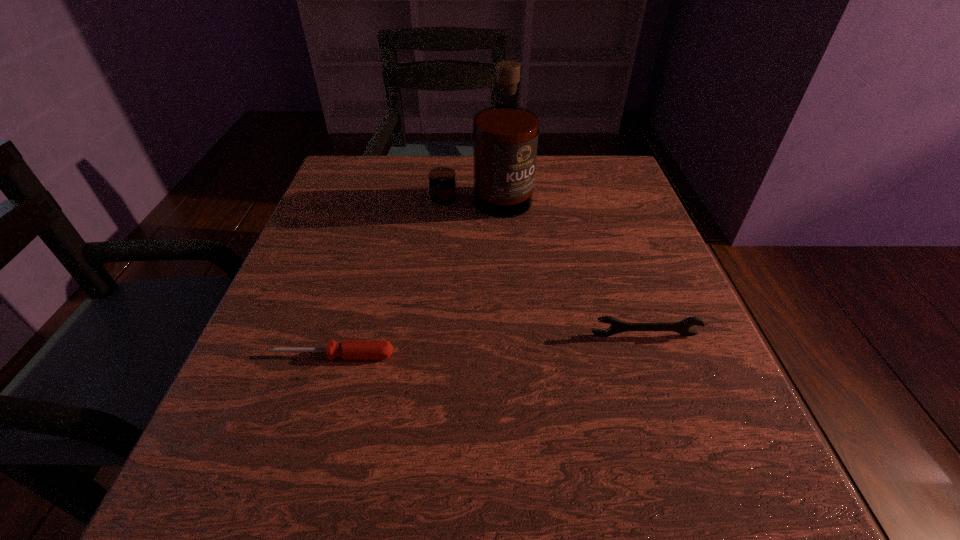
I want to click on free space between the farthest object and the leftmost object, so click(407, 278).

At what (x,y) coordinates should I click in order to perform the action: click on vacant space in between the second farthest object and the farthest object. Please return your answer as a coordinate pair (x, y). The image size is (960, 540). Looking at the image, I should click on (563, 268).

Identify the location of blank region between the leftmost object and the rightmost object. (489, 345).

In order to click on unoccupied area between the tallest object and the rightmost object in this screenshot , I will do `click(563, 268)`.

Find the location of a particular element. This screenshot has width=960, height=540. vacant point located between the rightmost object and the leftmost object is located at coordinates (489, 345).

Where is `vacant point located between the screwdriver and the liquor`? This screenshot has height=540, width=960. vacant point located between the screwdriver and the liquor is located at coordinates (407, 278).

What are the coordinates of `vacant point located between the shortest object and the farthest object` in the screenshot? It's located at (407, 278).

Where is `free point between the second tallest object and the nearest object`? The image size is (960, 540). free point between the second tallest object and the nearest object is located at coordinates (489, 345).

What are the coordinates of `the closest object to the second object from right to left` in the screenshot? It's located at (617, 326).

Identify which object is the closest to the rightmost object. Please provide its 2D coordinates. Your answer should be formatted as a tuple, i.e. [(x, y)], where the tuple contains the x and y coordinates of a point satisfying the conditions above.

[(349, 349)]